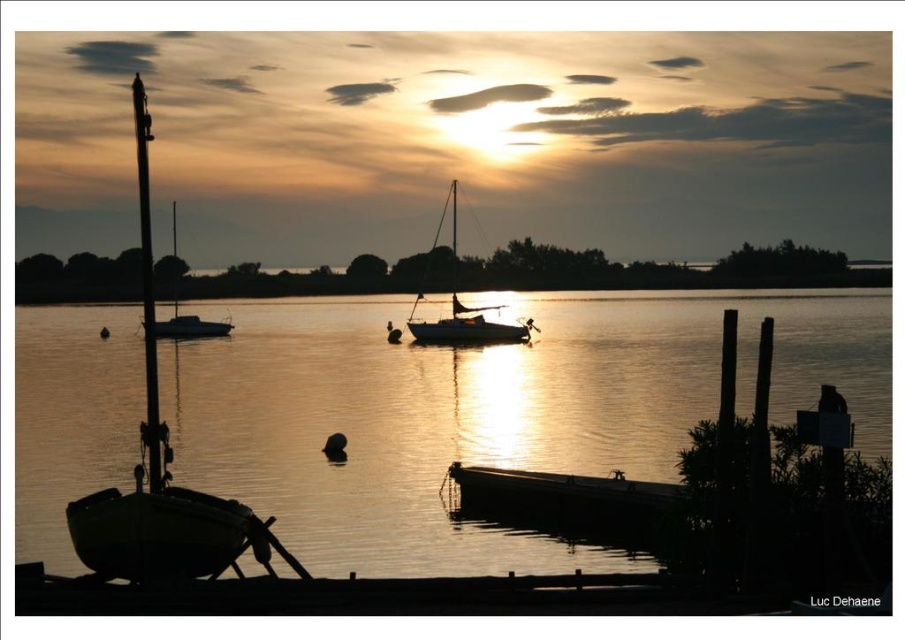
You are standing on the dock and want to retrieve an item that fell into the water near the silvery water at boat left and the silhouette sailboat at center. Which object is closer to you so you can reach it more easily?

The silvery water at boat left is closer to the viewer than the silhouette sailboat at center, so you can reach it more easily.

You are standing at the edge of the dock and want to take a photo of two points on the dock. The first point is at coordinates point (x=117, y=493) and the second is at point (x=430, y=330). Which point will appear larger in your photo?

Point (x=117, y=493) is closer to the camera than point (x=430, y=330). Since objects closer to the camera appear larger in a photo, the first point will appear larger in the photo.